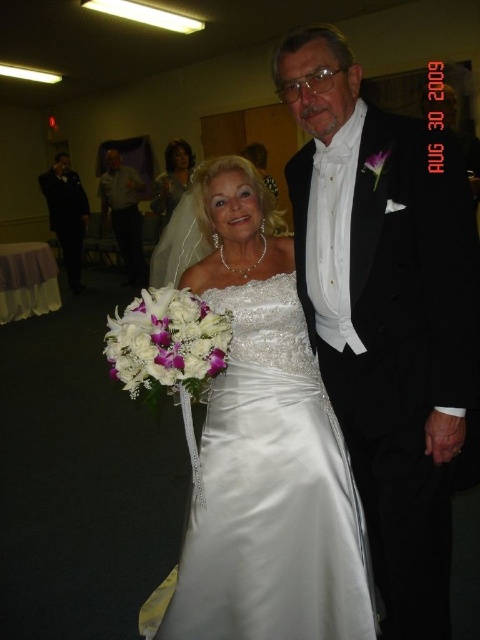
Is black satin tuxedo at center thinner than matte gray shirt at left?

Indeed, black satin tuxedo at center has a lesser width compared to matte gray shirt at left.

From the picture: Between black satin tuxedo at center and matte gray shirt at left, which one has more height?

With more height is matte gray shirt at left.

Is point (436, 269) closer to viewer compared to point (127, 180)?

Yes, point (436, 269) is in front of point (127, 180).

Where is `black satin tuxedo at center`? The image size is (480, 640). black satin tuxedo at center is located at coordinates (385, 312).

Which of these two, satin dress at center or matte gray shirt at left, stands shorter?

With less height is satin dress at center.

Does point (207, 550) lie behind point (117, 198)?

No, (207, 550) is in front of (117, 198).

Locate an element on the screen. This screenshot has height=640, width=480. satin dress at center is located at coordinates (263, 444).

Does black satin tuxedo at center lie in front of satin dress at upper center?

Yes, it is.

Does black satin tuxedo at center have a lesser height compared to satin dress at upper center?

Incorrect, black satin tuxedo at center's height does not fall short of satin dress at upper center's.

Describe the element at coordinates (385, 312) in the screenshot. I see `black satin tuxedo at center` at that location.

Locate an element on the screen. The image size is (480, 640). black satin tuxedo at center is located at coordinates (385, 312).